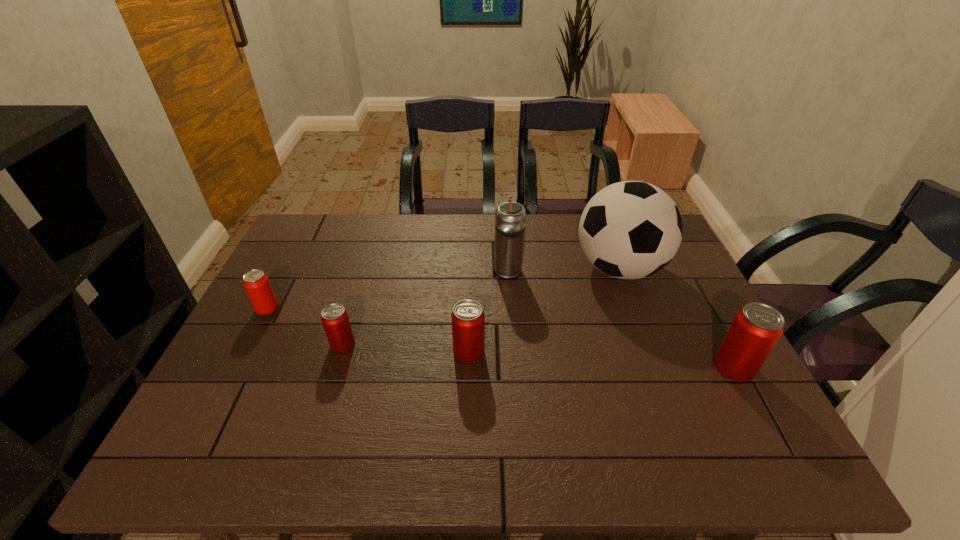
In order to click on can object that ranks as the third closest to the second object from right to left in this screenshot , I will do coord(335,320).

Select which can is the closest to the shortest can. Please provide its 2D coordinates. Your answer should be formatted as a tuple, i.e. [(x, y)], where the tuple contains the x and y coordinates of a point satisfying the conditions above.

[(468, 320)]

Identify the location of free location that satisfies the following two spatial constraints: 1. on the back side of the leftmost can; 2. on the left side of the fifth object from left to right. This screenshot has height=540, width=960. (366, 268).

Locate an element on the screen. The image size is (960, 540). free space that satisfies the following two spatial constraints: 1. on the back side of the soccer ball; 2. on the right side of the leftmost object is located at coordinates (289, 268).

I want to click on vacant area that satisfies the following two spatial constraints: 1. on the front side of the rightmost object; 2. on the right side of the second can from left to right, so click(468, 367).